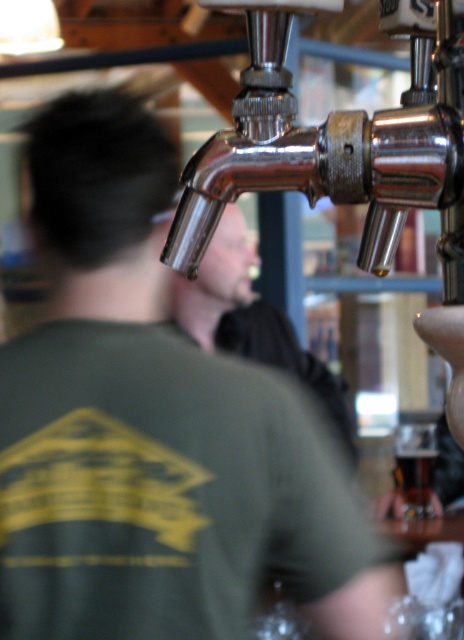
You are a bartender trying to clean the chrome metallic faucet at upper center and the shiny metallic faucet at center. Which faucet requires more cleaning solution because of its larger size?

The shiny metallic faucet at center requires more cleaning solution because it has a larger size compared to the chrome metallic faucet at upper center.

You are a bartender trying to clean the chrome metallic faucet at upper center. The cleaning solution you have is placed at point (339, 141). Is the cleaning solution right next to the faucet?

The chrome metallic faucet at upper center is located at point (339, 141), so yes, the cleaning solution is right next to the faucet since it shares the same coordinates.

You are a bartender trying to pour a beer into the translucent glass at center. Where should you position the chrome metallic faucet at upper center relative to the glass?

The chrome metallic faucet at upper center is located above the translucent glass at center, so you should position the faucet above the glass to pour the beer.